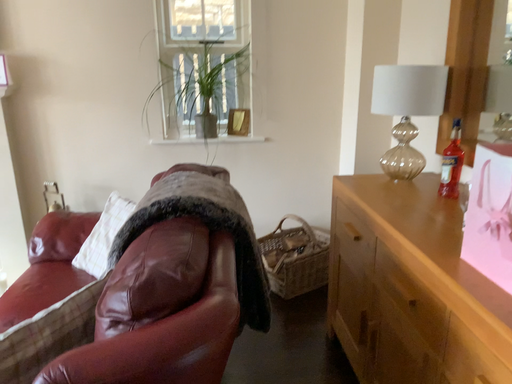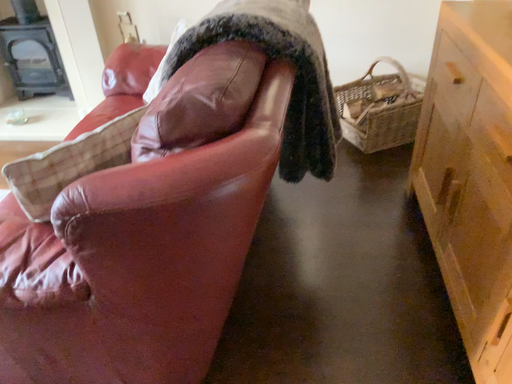
Question: How did the camera likely rotate when shooting the video?

Choices:
 (A) rotated right
 (B) rotated left

Answer: (B)